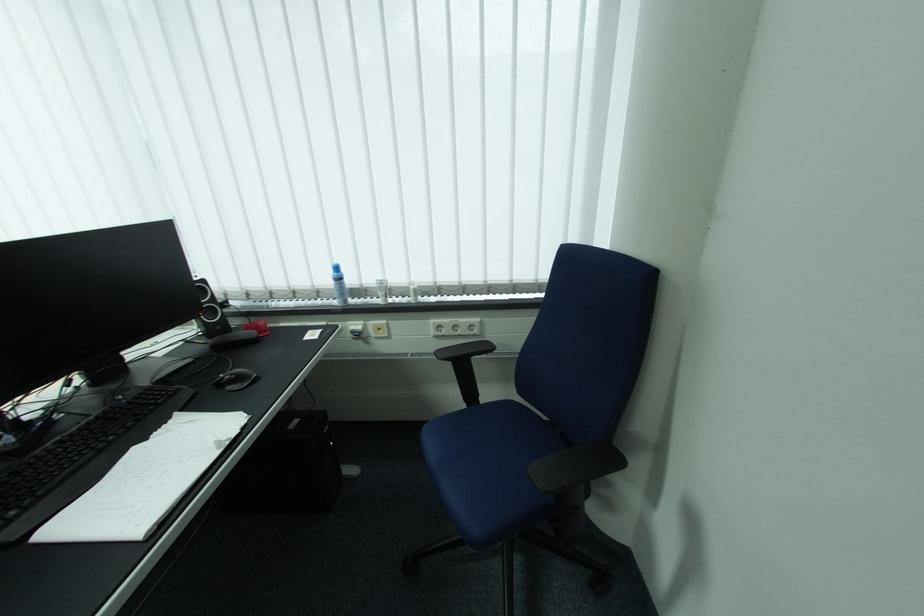
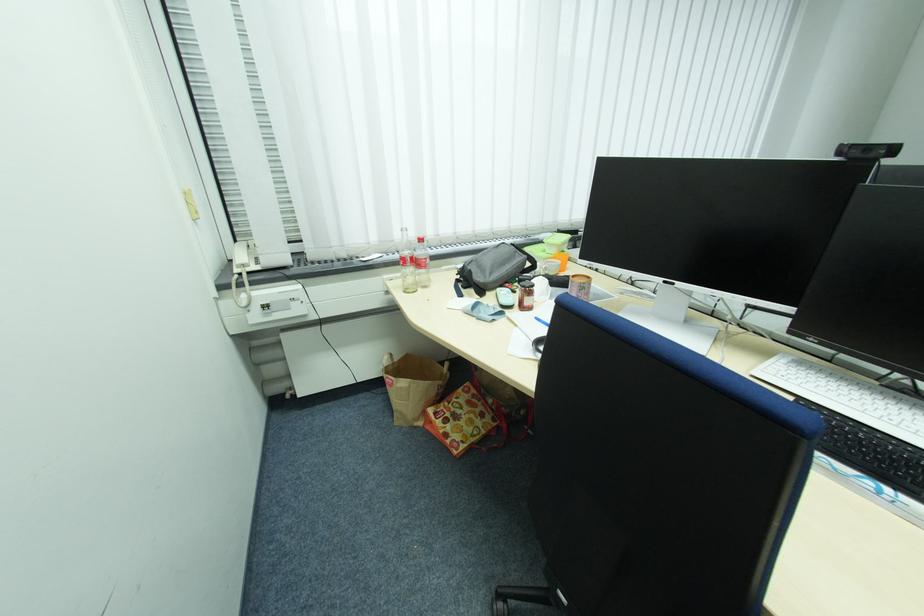
Question: What movement of the cameraman would produce the second image?

Choices:
 (A) Left
 (B) Right
 (C) Forward
 (D) Backward

Answer: (A)